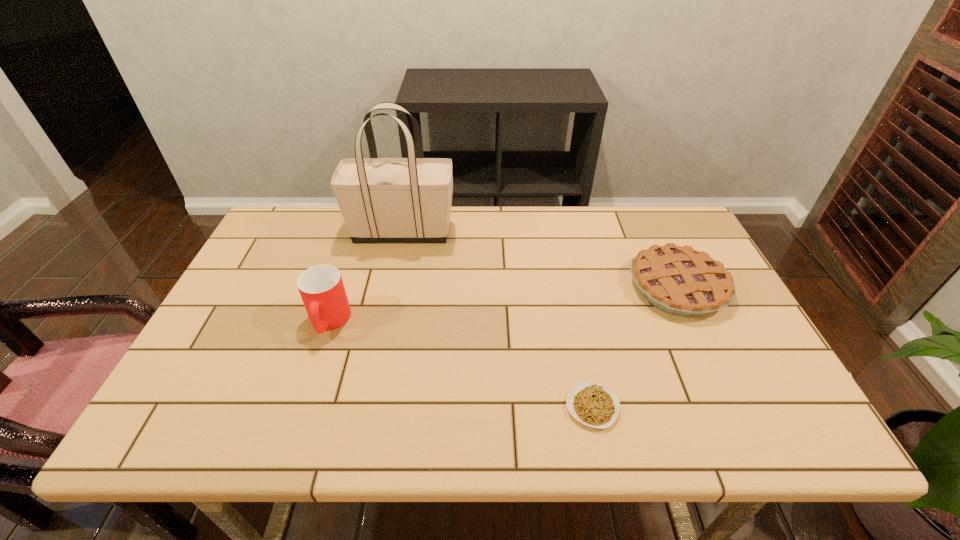
You are a GUI agent. You are given a task and a screenshot of the screen. Output one action in this format:
    pyautogui.click(x=<x>, y=<y>)
    Task: Click on the unoccupied area between the third tallest object and the nearest object
    
    Given the screenshot: What is the action you would take?
    pyautogui.click(x=635, y=347)

At what (x,y) coordinates should I click in order to perform the action: click on vacant space that is in between the farthest object and the third shortest object. Please return your answer as a coordinate pair (x, y). Looking at the image, I should click on (366, 276).

Find the location of `empty location between the cup and the shopping bag`. empty location between the cup and the shopping bag is located at coordinates (366, 276).

Identify the location of free area in between the rightmost object and the cup. This screenshot has height=540, width=960. (503, 304).

Where is `vacant area that lies between the farthest object and the cup`? Image resolution: width=960 pixels, height=540 pixels. vacant area that lies between the farthest object and the cup is located at coordinates (366, 276).

This screenshot has height=540, width=960. Find the location of `blank region between the rightmost object and the legume`. blank region between the rightmost object and the legume is located at coordinates coord(635,347).

Image resolution: width=960 pixels, height=540 pixels. In order to click on free spot between the cup and the shopping bag in this screenshot , I will do `click(366, 276)`.

This screenshot has width=960, height=540. Identify the location of empty space between the tallest object and the pie. point(540,259).

The height and width of the screenshot is (540, 960). Find the location of `empty space between the rightmost object and the nearest object`. empty space between the rightmost object and the nearest object is located at coordinates pyautogui.click(x=635, y=347).

Identify which object is the second nearest to the third shortest object. Please provide its 2D coordinates. Your answer should be formatted as a tuple, i.e. [(x, y)], where the tuple contains the x and y coordinates of a point satisfying the conditions above.

[(594, 405)]